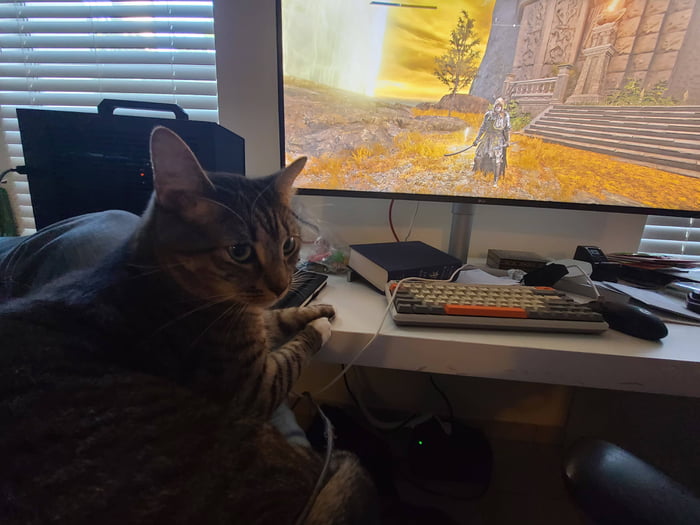
You are a GUI agent. You are given a task and a screenshot of the screen. Output one action in this format:
    pyautogui.click(x=<x>, y=<y>)
    Task: Click on the red wire behind monitor
    This screenshot has width=700, height=525.
    Given the screenshot: What is the action you would take?
    pyautogui.click(x=388, y=215)